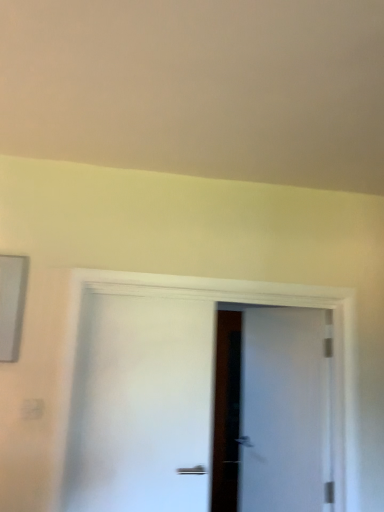
Question: Considering the relative positions of white matte door at center, which is the 2th door from right to left, and white matte door at center, which is the 2th door from left to right, in the image provided, is white matte door at center, which is the 2th door from right to left, to the left or to the right of white matte door at center, which is the 2th door from left to right,?

Choices:
 (A) right
 (B) left

Answer: (B)

Question: From a real-world perspective, relative to white matte door at center, the 1th door viewed from the back, is white matte door at center, which is the 2th door from right to left, vertically above or below?

Choices:
 (A) below
 (B) above

Answer: (B)

Question: Is point (137, 369) closer or farther from the camera than point (253, 312)?

Choices:
 (A) farther
 (B) closer

Answer: (B)

Question: From a real-world perspective, is white matte door at center, which is the 2th door from left to right, above or below white matte door at center, the first door in the left-to-right sequence?

Choices:
 (A) above
 (B) below

Answer: (B)

Question: In terms of width, does white matte door at center, which is the second door from front to back, look wider or thinner when compared to white matte door at center, the first door when ordered from front to back?

Choices:
 (A) thin
 (B) wide

Answer: (B)

Question: Which is correct: white matte door at center, which is the 2th door from left to right, is inside white matte door at center, which is the 2th door from right to left, or outside of it?

Choices:
 (A) outside
 (B) inside

Answer: (A)

Question: Based on their positions, is white matte door at center, the 1th door viewed from the back, located to the left or right of white matte door at center, the first door when ordered from front to back?

Choices:
 (A) right
 (B) left

Answer: (A)